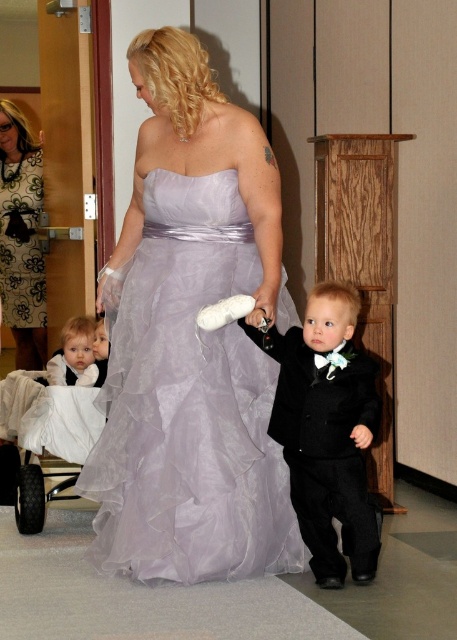
What are the coordinates of the lavender tulle dress at center in the image?

The coordinates of the lavender tulle dress at center are at point (187, 403).